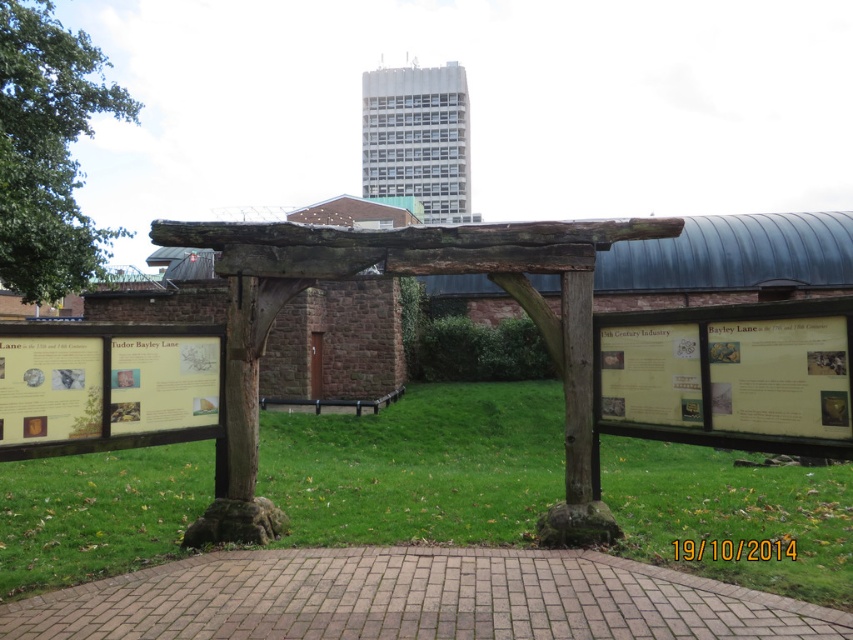
You are standing at the edge of the grassy area and want to walk to the brick paved path at center. Which direction should you walk to reach it?

The brick paved path at center is located at point (415, 598), so you should walk towards the center of the image to reach it.

You are a tour guide leading a group through the historical exhibit. You want to ensure everyone can walk comfortably between the brick paved path at center and the brown wooden pergola at upper center. Considering their sizes, which one might you need to adjust to create more space?

The brick paved path at center occupies less space than the brown wooden pergola at upper center, so you would need to adjust the brown wooden pergola at upper center to create more space since it takes up more area.

From the picture: You are a tourist visiting the historical exhibit and want to walk through the brick paved path at center. Can you do so without going under the weathered wood arch at center?

The brick paved path at center is positioned under the weathered wood arch at center, so you would have to go under the arch to walk through the path.